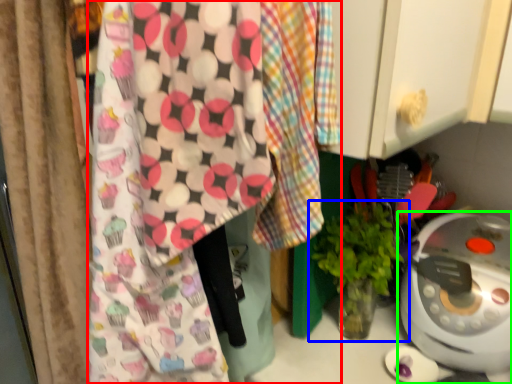
Question: Which object is the farthest from wrapping paper (highlighted by a red box)? Choose among these: houseplant (highlighted by a blue box) or home appliance (highlighted by a green box).

Choices:
 (A) houseplant
 (B) home appliance

Answer: (B)